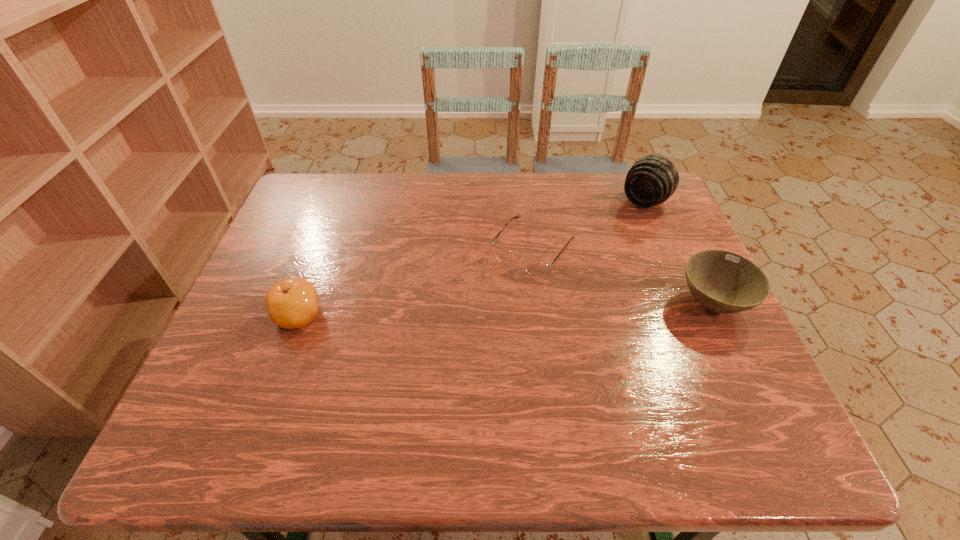
In order to click on vacant space positioned on the front-facing side of the second object from left to right in this screenshot , I will do `click(462, 344)`.

In order to click on free space located at the front element of the tallest object in this screenshot , I will do `click(600, 252)`.

Find the location of a particular element. This screenshot has width=960, height=540. vacant space located at the front element of the tallest object is located at coordinates (584, 271).

This screenshot has width=960, height=540. Find the location of `vacant region located 0.290m at the front element of the tallest object`. vacant region located 0.290m at the front element of the tallest object is located at coordinates (586, 269).

Find the location of a particular element. This screenshot has width=960, height=540. object that is at the far edge is located at coordinates (653, 179).

The image size is (960, 540). Find the location of `object that is at the left edge`. object that is at the left edge is located at coordinates (291, 303).

You are a GUI agent. You are given a task and a screenshot of the screen. Output one action in this format:
    pyautogui.click(x=<x>, y=<y>)
    Task: Click on the bowl positioned at the right edge
    The width and height of the screenshot is (960, 540).
    Given the screenshot: What is the action you would take?
    pyautogui.click(x=724, y=282)

This screenshot has width=960, height=540. Identify the location of telephoto lens located at the right edge. (653, 179).

You are a GUI agent. You are given a task and a screenshot of the screen. Output one action in this format:
    pyautogui.click(x=<x>, y=<y>)
    Task: Click on the object that is positioned at the far right corner
    The width and height of the screenshot is (960, 540).
    Given the screenshot: What is the action you would take?
    pyautogui.click(x=653, y=179)

You are a GUI agent. You are given a task and a screenshot of the screen. Output one action in this format:
    pyautogui.click(x=<x>, y=<y>)
    Task: Click on the free space at the far edge of the desktop
    
    Given the screenshot: What is the action you would take?
    pyautogui.click(x=430, y=211)